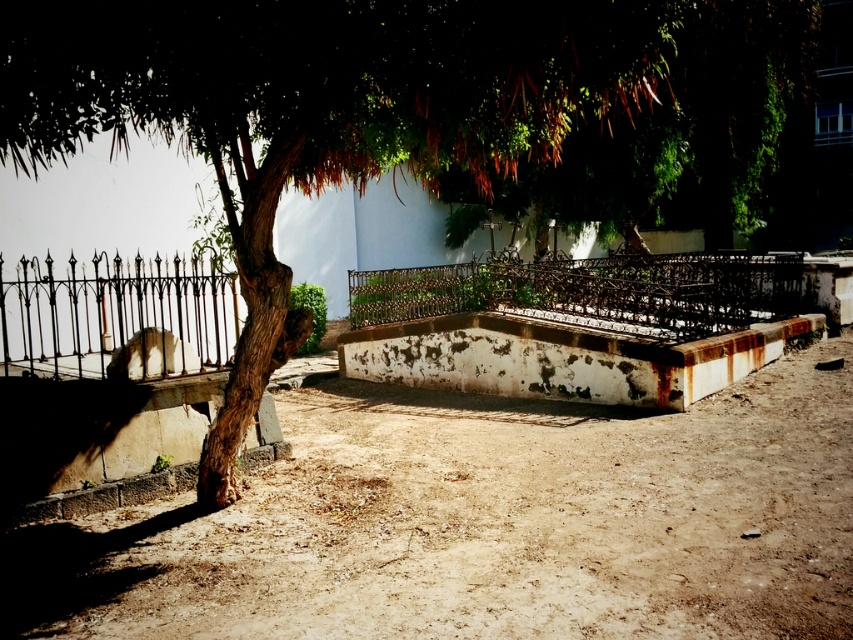
Question: Is brown dusty ground at center closer to the viewer compared to black wrought iron fence at left?

Choices:
 (A) yes
 (B) no

Answer: (A)

Question: Among these points, which one is nearest to the camera?

Choices:
 (A) (350, 35)
 (B) (90, 320)

Answer: (A)

Question: Which object appears farthest from the camera in this image?

Choices:
 (A) green leafy tree at center
 (B) black wrought iron fence at left
 (C) rusty metal fence at center

Answer: (C)

Question: Is brown dusty ground at center in front of green leafy tree at center?

Choices:
 (A) no
 (B) yes

Answer: (A)

Question: Which object appears farthest from the camera in this image?

Choices:
 (A) rusty metal fence at center
 (B) green leafy tree at center
 (C) brown dusty ground at center

Answer: (A)

Question: Is brown dusty ground at center to the right of black wrought iron fence at left from the viewer's perspective?

Choices:
 (A) no
 (B) yes

Answer: (A)